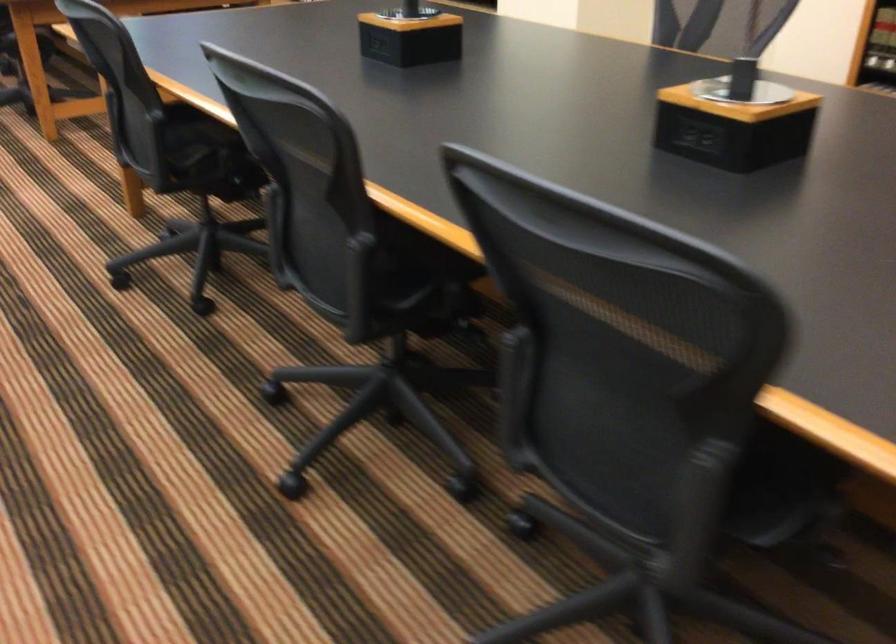
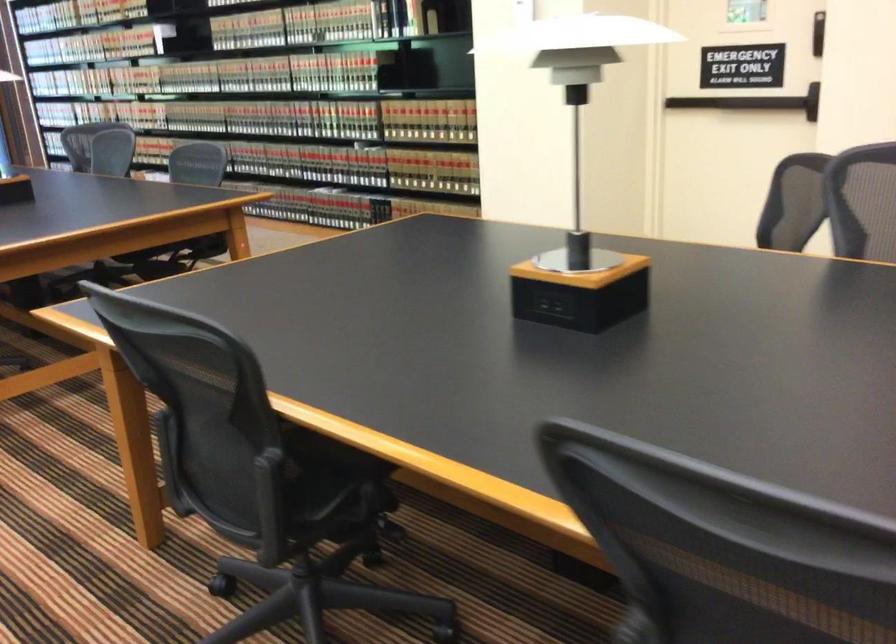
The images are taken continuously from a first-person perspective. In which direction are you moving?

The cameraman moved toward left, forward.